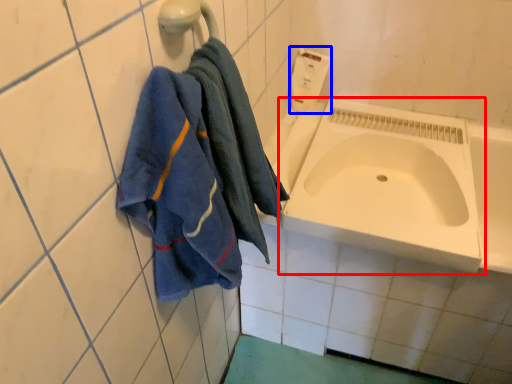
Question: Among these objects, which one is nearest to the camera, sink (highlighted by a red box) or soap dispenser (highlighted by a blue box)?

Choices:
 (A) sink
 (B) soap dispenser

Answer: (A)